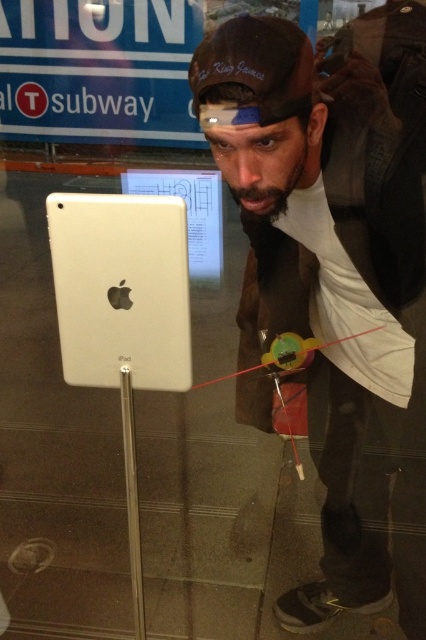
You are a photographer setting up for a product shoot. You have a white matte ipad at center and a silver metallic pole at center in your frame. Which object is positioned closer to the camera?

The white matte ipad at center is closer to the viewer than the silver metallic pole at center, so it appears closer to the camera.

You are a photographer setting up for a product shoot. You have a silver metallic pole at center and a green plastic toy at center in your setup. Which object is positioned lower in the scene?

The silver metallic pole at center is below the green plastic toy at center, so the silver metallic pole at center is positioned lower in the scene.